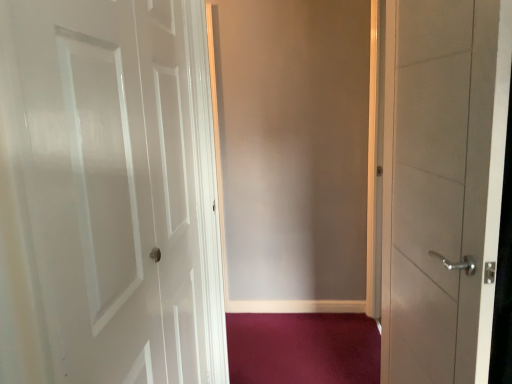
Question: Is point (478, 21) closer or farther from the camera than point (243, 317)?

Choices:
 (A) closer
 (B) farther

Answer: (A)

Question: Looking at the image, does satin white door at right, marked as the first door in a right-to-left arrangement, seem bigger or smaller compared to purple carpet at lower center?

Choices:
 (A) small
 (B) big

Answer: (B)

Question: Which object is positioned closest to the satin white door at right, arranged as the second door when viewed from the left?

Choices:
 (A) white glossy door at left, the second door from the right
 (B) purple carpet at lower center
 (C) matte gray screen door at center

Answer: (A)

Question: Considering the real-world distances, which object is farthest from the matte gray screen door at center?

Choices:
 (A) purple carpet at lower center
 (B) satin white door at right, arranged as the second door when viewed from the left
 (C) white glossy door at left, the first door in the left-to-right sequence

Answer: (B)